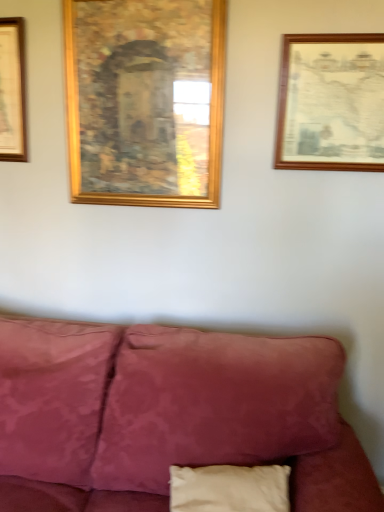
What is the approximate width of gold wooden picture frame at upper center, which is the first picture frame in left-to-right order?

The width of gold wooden picture frame at upper center, which is the first picture frame in left-to-right order, is 3.29 inches.

The height and width of the screenshot is (512, 384). What do you see at coordinates (145, 101) in the screenshot? I see `gold wooden picture frame at upper center, the second picture frame in the right-to-left sequence` at bounding box center [145, 101].

Find the location of `gold wooden picture frame at upper center, which is the first picture frame in left-to-right order`. gold wooden picture frame at upper center, which is the first picture frame in left-to-right order is located at coordinates (145, 101).

This screenshot has height=512, width=384. Describe the element at coordinates (331, 103) in the screenshot. I see `wooden picture frame at upper right, which is counted as the 2th picture frame, starting from the left` at that location.

Find the location of `wooden picture frame at upper right, which is counted as the 2th picture frame, starting from the left`. wooden picture frame at upper right, which is counted as the 2th picture frame, starting from the left is located at coordinates (331, 103).

Locate an element on the screen. gold wooden picture frame at upper center, the second picture frame in the right-to-left sequence is located at coordinates (145, 101).

In the image, is wooden picture frame at upper right, which is counted as the 2th picture frame, starting from the left, on the left side or the right side of gold wooden picture frame at upper center, which is the first picture frame in left-to-right order?

Clearly, wooden picture frame at upper right, which is counted as the 2th picture frame, starting from the left, is on the right of gold wooden picture frame at upper center, which is the first picture frame in left-to-right order, in the image.

Is wooden picture frame at upper right, which is counted as the 2th picture frame, starting from the left, positioned in front of gold wooden picture frame at upper center, the second picture frame in the right-to-left sequence?

Yes, it is.

Is point (367, 45) closer to camera compared to point (128, 42)?

Yes, point (367, 45) is closer to viewer.

From the image's perspective, which one is positioned lower, wooden picture frame at upper right, which is the first picture frame from right to left, or gold wooden picture frame at upper center, which is the first picture frame in left-to-right order?

wooden picture frame at upper right, which is the first picture frame from right to left, is shown below in the image.

From a real-world perspective, between wooden picture frame at upper right, which is the first picture frame from right to left, and gold wooden picture frame at upper center, the second picture frame in the right-to-left sequence, who is vertically lower?

wooden picture frame at upper right, which is the first picture frame from right to left, is physically lower.

Consider the image. Does wooden picture frame at upper right, which is the first picture frame from right to left, have a greater width compared to gold wooden picture frame at upper center, which is the first picture frame in left-to-right order?

In fact, wooden picture frame at upper right, which is the first picture frame from right to left, might be narrower than gold wooden picture frame at upper center, which is the first picture frame in left-to-right order.

In terms of height, does wooden picture frame at upper right, which is counted as the 2th picture frame, starting from the left, look taller or shorter compared to gold wooden picture frame at upper center, which is the first picture frame in left-to-right order?

wooden picture frame at upper right, which is counted as the 2th picture frame, starting from the left, is shorter than gold wooden picture frame at upper center, which is the first picture frame in left-to-right order.

In the scene shown: Considering the sizes of objects wooden picture frame at upper right, which is counted as the 2th picture frame, starting from the left, and gold wooden picture frame at upper center, the second picture frame in the right-to-left sequence, in the image provided, who is smaller, wooden picture frame at upper right, which is counted as the 2th picture frame, starting from the left, or gold wooden picture frame at upper center, the second picture frame in the right-to-left sequence,?

wooden picture frame at upper right, which is counted as the 2th picture frame, starting from the left.

Is wooden picture frame at upper right, which is the first picture frame from right to left, completely or partially outside of gold wooden picture frame at upper center, which is the first picture frame in left-to-right order?

wooden picture frame at upper right, which is the first picture frame from right to left, is positioned outside gold wooden picture frame at upper center, which is the first picture frame in left-to-right order.

Is wooden picture frame at upper right, which is counted as the 2th picture frame, starting from the left, directly adjacent to gold wooden picture frame at upper center, the second picture frame in the right-to-left sequence?

No, wooden picture frame at upper right, which is counted as the 2th picture frame, starting from the left, is not beside gold wooden picture frame at upper center, the second picture frame in the right-to-left sequence.

Is wooden picture frame at upper right, which is the first picture frame from right to left, facing away from gold wooden picture frame at upper center, which is the first picture frame in left-to-right order?

No, wooden picture frame at upper right, which is the first picture frame from right to left,'s orientation is not away from gold wooden picture frame at upper center, which is the first picture frame in left-to-right order.

How many degrees apart are the facing directions of wooden picture frame at upper right, which is the first picture frame from right to left, and gold wooden picture frame at upper center, the second picture frame in the right-to-left sequence?

wooden picture frame at upper right, which is the first picture frame from right to left, and gold wooden picture frame at upper center, the second picture frame in the right-to-left sequence, are facing 0.0116 degrees away from each other.

At what (x,y) coordinates should I click in order to perform the action: click on picture frame lying on the left of wooden picture frame at upper right, which is counted as the 2th picture frame, starting from the left. Please return your answer as a coordinate pair (x, y). Looking at the image, I should click on (145, 101).

Which is more to the right, gold wooden picture frame at upper center, which is the first picture frame in left-to-right order, or wooden picture frame at upper right, which is counted as the 2th picture frame, starting from the left?

Positioned to the right is wooden picture frame at upper right, which is counted as the 2th picture frame, starting from the left.

Considering the positions of objects gold wooden picture frame at upper center, the second picture frame in the right-to-left sequence, and wooden picture frame at upper right, which is the first picture frame from right to left, in the image provided, who is in front, gold wooden picture frame at upper center, the second picture frame in the right-to-left sequence, or wooden picture frame at upper right, which is the first picture frame from right to left,?

wooden picture frame at upper right, which is the first picture frame from right to left, is more forward.

Is point (95, 172) positioned in front of point (323, 126)?

No, (95, 172) is further to viewer.

Looking at this image, from the image's perspective, is gold wooden picture frame at upper center, the second picture frame in the right-to-left sequence, over wooden picture frame at upper right, which is counted as the 2th picture frame, starting from the left?

Correct, gold wooden picture frame at upper center, the second picture frame in the right-to-left sequence, appears higher than wooden picture frame at upper right, which is counted as the 2th picture frame, starting from the left, in the image.

From a real-world perspective, which is physically below, gold wooden picture frame at upper center, the second picture frame in the right-to-left sequence, or wooden picture frame at upper right, which is counted as the 2th picture frame, starting from the left?

wooden picture frame at upper right, which is counted as the 2th picture frame, starting from the left, from a real-world perspective.

Is gold wooden picture frame at upper center, the second picture frame in the right-to-left sequence, wider or thinner than wooden picture frame at upper right, which is counted as the 2th picture frame, starting from the left?

In the image, gold wooden picture frame at upper center, the second picture frame in the right-to-left sequence, appears to be wider than wooden picture frame at upper right, which is counted as the 2th picture frame, starting from the left.

Which of these two, gold wooden picture frame at upper center, which is the first picture frame in left-to-right order, or wooden picture frame at upper right, which is the first picture frame from right to left, stands shorter?

Standing shorter between the two is wooden picture frame at upper right, which is the first picture frame from right to left.

Is gold wooden picture frame at upper center, which is the first picture frame in left-to-right order, bigger than wooden picture frame at upper right, which is counted as the 2th picture frame, starting from the left?

Yes, gold wooden picture frame at upper center, which is the first picture frame in left-to-right order, is bigger than wooden picture frame at upper right, which is counted as the 2th picture frame, starting from the left.

Would you say wooden picture frame at upper right, which is the first picture frame from right to left, is part of gold wooden picture frame at upper center, which is the first picture frame in left-to-right order,'s contents?

No, wooden picture frame at upper right, which is the first picture frame from right to left, is not inside gold wooden picture frame at upper center, which is the first picture frame in left-to-right order.

Are gold wooden picture frame at upper center, which is the first picture frame in left-to-right order, and wooden picture frame at upper right, which is the first picture frame from right to left, located far from each other?

Actually, gold wooden picture frame at upper center, which is the first picture frame in left-to-right order, and wooden picture frame at upper right, which is the first picture frame from right to left, are a little close together.

Is gold wooden picture frame at upper center, the second picture frame in the right-to-left sequence, turned away from wooden picture frame at upper right, which is counted as the 2th picture frame, starting from the left?

No, gold wooden picture frame at upper center, the second picture frame in the right-to-left sequence, is not facing away from wooden picture frame at upper right, which is counted as the 2th picture frame, starting from the left.

How many degrees apart are the facing directions of gold wooden picture frame at upper center, which is the first picture frame in left-to-right order, and wooden picture frame at upper right, which is counted as the 2th picture frame, starting from the left?

The angular difference between gold wooden picture frame at upper center, which is the first picture frame in left-to-right order, and wooden picture frame at upper right, which is counted as the 2th picture frame, starting from the left, is 0.0116 degrees.

Measure the distance between gold wooden picture frame at upper center, the second picture frame in the right-to-left sequence, and wooden picture frame at upper right, which is counted as the 2th picture frame, starting from the left.

17.71 inches.

I want to click on picture frame in front of the gold wooden picture frame at upper center, the second picture frame in the right-to-left sequence, so coord(331,103).

In order to click on picture frame in front of the gold wooden picture frame at upper center, which is the first picture frame in left-to-right order in this screenshot , I will do `click(331, 103)`.

Locate an element on the screen. Image resolution: width=384 pixels, height=512 pixels. picture frame below the gold wooden picture frame at upper center, the second picture frame in the right-to-left sequence (from the image's perspective) is located at coordinates (331, 103).